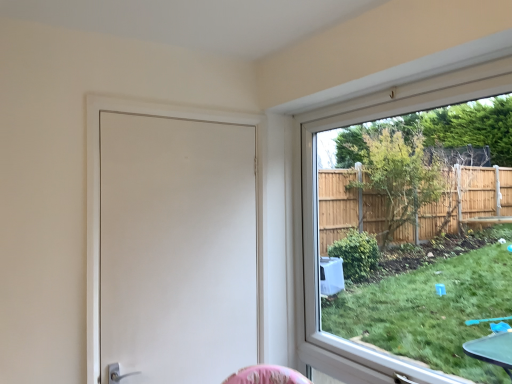
Question: Is clear glass window at upper right facing towards white matte door at left?

Choices:
 (A) no
 (B) yes

Answer: (B)

Question: Is clear glass window at upper right directly adjacent to white matte door at left?

Choices:
 (A) yes
 (B) no

Answer: (B)

Question: From the image's perspective, would you say clear glass window at upper right is shown under white matte door at left?

Choices:
 (A) yes
 (B) no

Answer: (B)

Question: Is clear glass window at upper right thinner than white matte door at left?

Choices:
 (A) yes
 (B) no

Answer: (B)

Question: Considering the relative sizes of clear glass window at upper right and white matte door at left in the image provided, is clear glass window at upper right shorter than white matte door at left?

Choices:
 (A) no
 (B) yes

Answer: (A)

Question: Can you confirm if clear glass window at upper right is smaller than white matte door at left?

Choices:
 (A) no
 (B) yes

Answer: (A)

Question: Is white matte door at left shorter than clear glass window at upper right?

Choices:
 (A) yes
 (B) no

Answer: (A)

Question: From the image's perspective, would you say white matte door at left is shown under clear glass window at upper right?

Choices:
 (A) no
 (B) yes

Answer: (B)

Question: From a real-world perspective, is white matte door at left beneath clear glass window at upper right?

Choices:
 (A) yes
 (B) no

Answer: (B)

Question: Is white matte door at left thinner than clear glass window at upper right?

Choices:
 (A) no
 (B) yes

Answer: (B)

Question: Is white matte door at left bigger than clear glass window at upper right?

Choices:
 (A) yes
 (B) no

Answer: (B)

Question: Does white matte door at left turn towards clear glass window at upper right?

Choices:
 (A) yes
 (B) no

Answer: (B)

Question: Is clear glass window at upper right taller or shorter than white matte door at left?

Choices:
 (A) short
 (B) tall

Answer: (B)